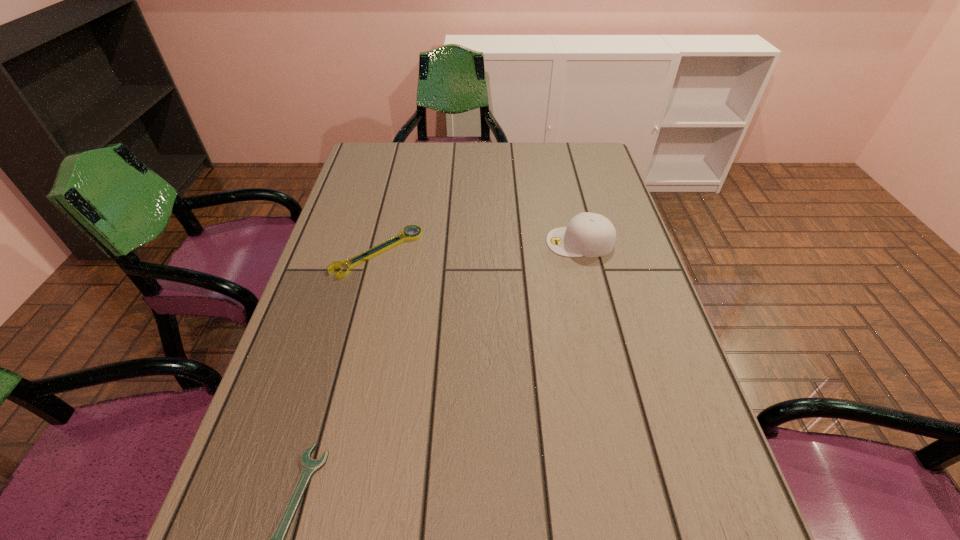
Locate an element on the screen. The image size is (960, 540). cap is located at coordinates (587, 234).

Locate an element on the screen. the tallest object is located at coordinates pos(587,234).

This screenshot has height=540, width=960. Find the location of `the farther wrench`. the farther wrench is located at coordinates (372, 252).

Where is `vacant position located on the front-facing side of the cap`? Image resolution: width=960 pixels, height=540 pixels. vacant position located on the front-facing side of the cap is located at coordinates (474, 242).

I want to click on vacant space located on the front-facing side of the cap, so click(x=467, y=242).

The width and height of the screenshot is (960, 540). What are the coordinates of `free location located on the front-facing side of the cap` in the screenshot? It's located at (467, 242).

Locate an element on the screen. The width and height of the screenshot is (960, 540). vacant space located on the right of the farther wrench is located at coordinates (535, 252).

Identify the location of object that is at the left edge. The width and height of the screenshot is (960, 540). (372, 252).

At what (x,y) coordinates should I click in order to perform the action: click on object that is at the right edge. Please return your answer as a coordinate pair (x, y). This screenshot has height=540, width=960. Looking at the image, I should click on (587, 234).

Image resolution: width=960 pixels, height=540 pixels. Identify the location of free space at the left edge of the desktop. click(x=255, y=431).